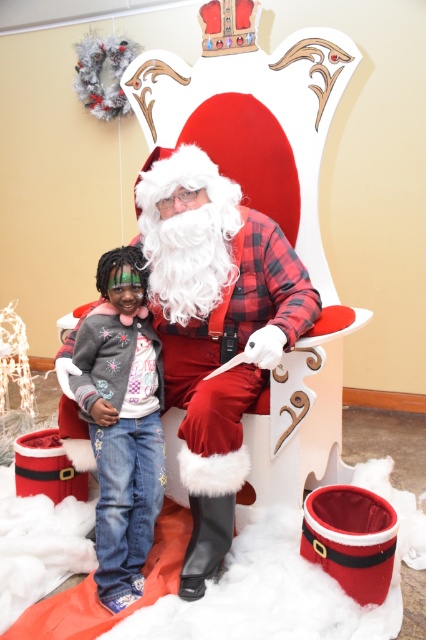
Based on the photo, can you confirm if fuzzy white beard at center is taller than denim jacket at lower left?

Yes, fuzzy white beard at center is taller than denim jacket at lower left.

Is fuzzy white beard at center smaller than denim jacket at lower left?

Actually, fuzzy white beard at center might be larger than denim jacket at lower left.

Locate an element on the screen. The height and width of the screenshot is (640, 426). fuzzy white beard at center is located at coordinates (215, 330).

Identify the location of fuzzy white beard at center. (215, 330).